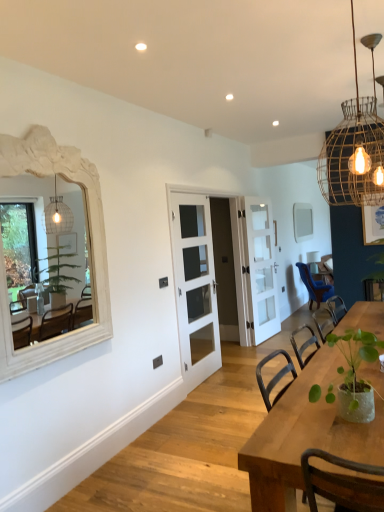
Question: Is white carved wood mirror at left, the 1th mirror when ordered from left to right, behind wooden table at center?

Choices:
 (A) yes
 (B) no

Answer: (A)

Question: Is white carved wood mirror at left, which ranks as the 2th mirror in back-to-front order, positioned with its back to wooden table at center?

Choices:
 (A) yes
 (B) no

Answer: (B)

Question: Can you confirm if white carved wood mirror at left, which appears as the second mirror when viewed from the right, is shorter than wooden table at center?

Choices:
 (A) yes
 (B) no

Answer: (B)

Question: From the image's perspective, is white carved wood mirror at left, which appears as the second mirror when viewed from the right, below wooden table at center?

Choices:
 (A) yes
 (B) no

Answer: (B)

Question: Can you confirm if white carved wood mirror at left, arranged as the first mirror when viewed from the front, is positioned to the right of wooden table at center?

Choices:
 (A) yes
 (B) no

Answer: (B)

Question: Is white glass door at center, the 2th door viewed from the front, inside the boundaries of white glass door at center, the first door positioned from the front, or outside?

Choices:
 (A) outside
 (B) inside

Answer: (B)

Question: Is white glass door at center, the second door positioned from the back, taller or shorter than white glass door at center, the first door positioned from the front?

Choices:
 (A) short
 (B) tall

Answer: (A)

Question: From a real-world perspective, is white glass door at center, the second door positioned from the back, above or below white glass door at center, the first door positioned from the front?

Choices:
 (A) below
 (B) above

Answer: (A)

Question: Considering the positions of white glass door at center, the second door positioned from the back, and white glass door at center, the first door positioned from the front, in the image, is white glass door at center, the second door positioned from the back, wider or thinner than white glass door at center, the first door positioned from the front,?

Choices:
 (A) wide
 (B) thin

Answer: (A)

Question: In the image, is white glossy door at center, which appears as the first door when viewed from the back, on the left side or the right side of wooden table at center?

Choices:
 (A) left
 (B) right

Answer: (A)

Question: Is white glossy door at center, which appears as the first door when viewed from the back, wider or thinner than wooden table at center?

Choices:
 (A) thin
 (B) wide

Answer: (A)

Question: Is point (254, 209) positioned closer to the camera than point (360, 437)?

Choices:
 (A) farther
 (B) closer

Answer: (A)

Question: From a real-world perspective, relative to wooden table at center, is white glossy door at center, which appears as the first door when viewed from the back, vertically above or below?

Choices:
 (A) above
 (B) below

Answer: (A)

Question: In terms of width, does white carved wood mirror at left, arranged as the first mirror when viewed from the front, look wider or thinner when compared to white glass door at center, the 2th door viewed from the front?

Choices:
 (A) wide
 (B) thin

Answer: (B)

Question: In terms of size, does white carved wood mirror at left, which ranks as the 2th mirror in back-to-front order, appear bigger or smaller than white glass door at center, the second door positioned from the back?

Choices:
 (A) small
 (B) big

Answer: (A)